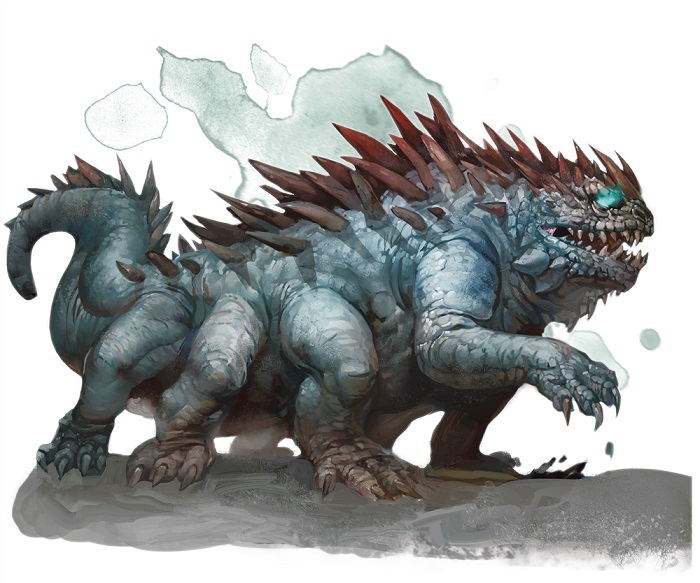
Locate an element on the screen. This screenshot has width=700, height=583. floor is located at coordinates (297, 511).